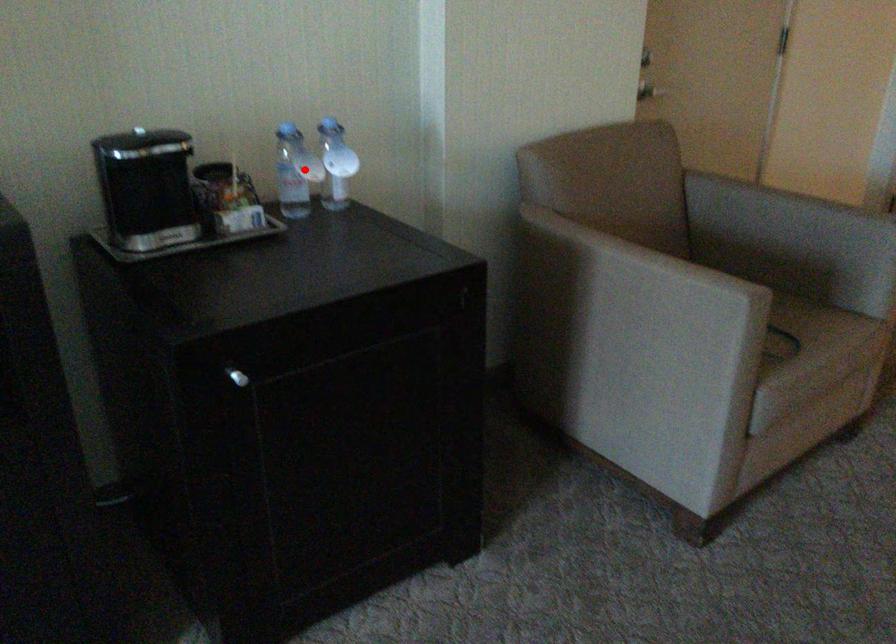
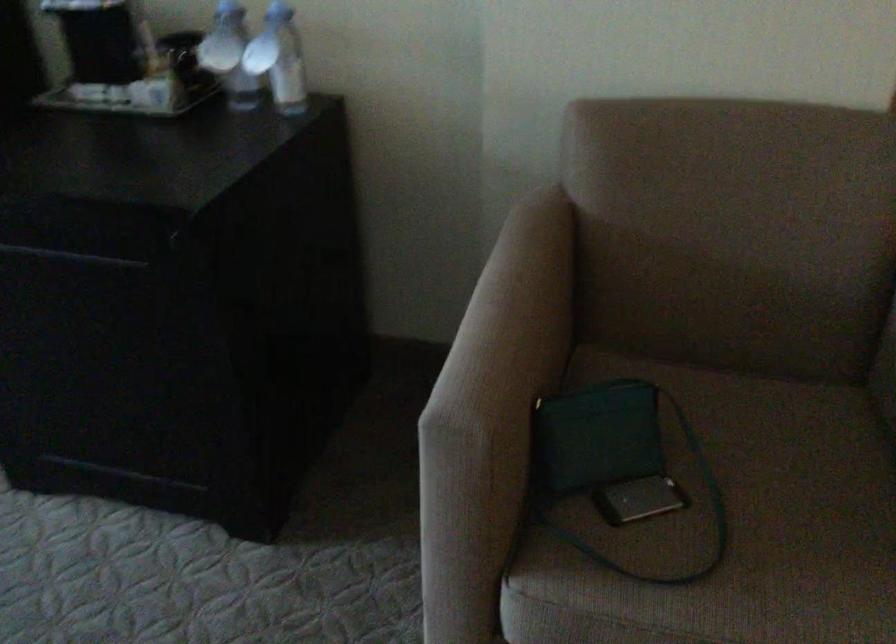
Question: I am providing you with two images of the same scene from different viewpoints. Image1 has a red point marked. In image2, the corresponding 3D location appears at what relative position? Reply with the corresponding letter.

Choices:
 (A) Closer
 (B) Farther

Answer: (A)